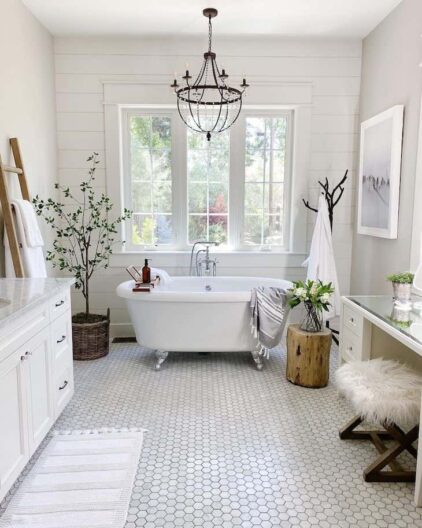
This screenshot has height=528, width=422. In order to click on white clawfoot bathtub in this screenshot , I will do `click(202, 325)`.